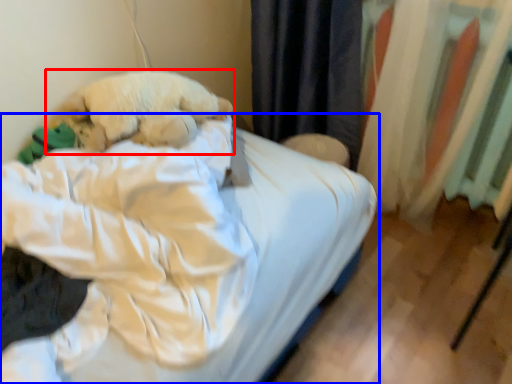
Question: Which of the following is the closest to the observer, dog (highlighted by a red box) or bed (highlighted by a blue box)?

Choices:
 (A) dog
 (B) bed

Answer: (B)